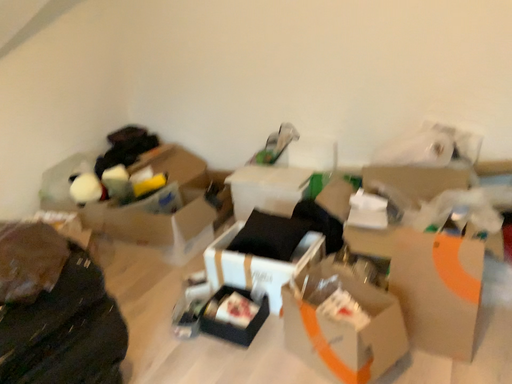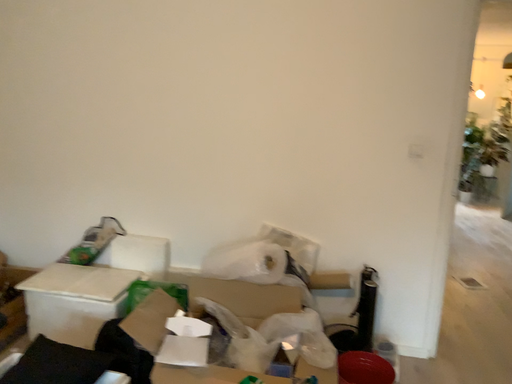
Question: Which way did the camera rotate in the video?

Choices:
 (A) rotated upward
 (B) rotated downward

Answer: (A)